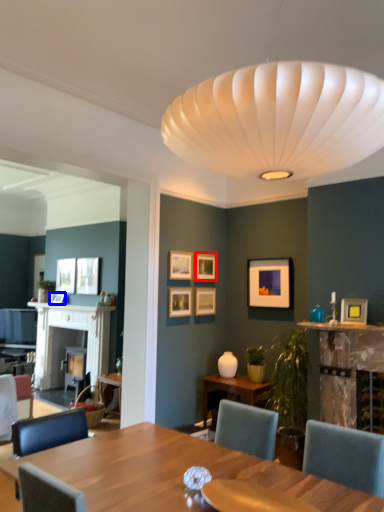
Question: Which object appears closest to the camera in this image, picture frame (highlighted by a red box) or picture frame (highlighted by a blue box)?

Choices:
 (A) picture frame
 (B) picture frame

Answer: (A)